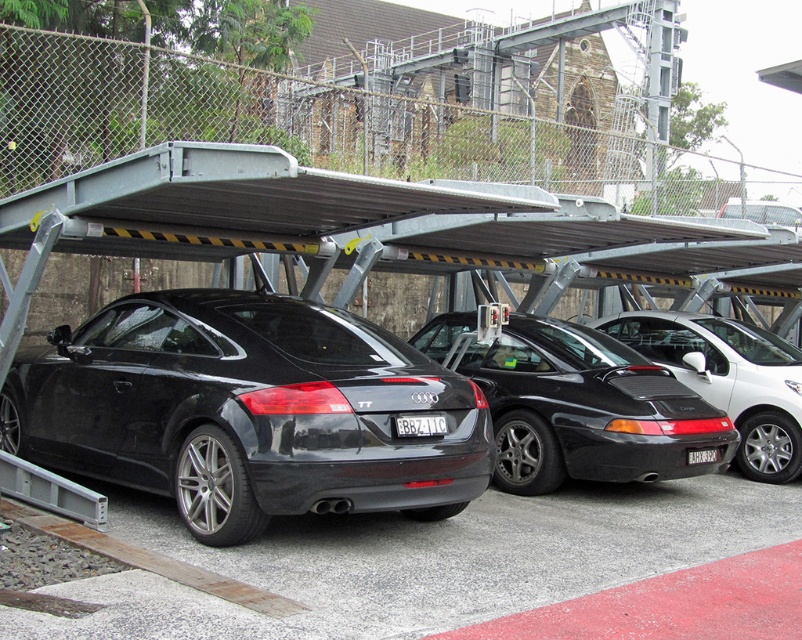
Question: Observing the image, what is the correct spatial positioning of black matte car at center in reference to white plastic license plate at center?

Choices:
 (A) below
 (B) above

Answer: (A)

Question: Which of the following is the closest to the observer?

Choices:
 (A) (709, 456)
 (B) (438, 385)
 (C) (788, 436)

Answer: (B)

Question: In this image, where is glossy black car at center located relative to black matte sports car at center?

Choices:
 (A) left
 (B) right

Answer: (A)

Question: Which point is closer to the camera?

Choices:
 (A) black matte car at center
 (B) black matte sports car at center
 (C) glossy black car at center
 (D) white plastic license plate at center

Answer: (C)

Question: Is black matte sports car at center to the right of white plastic license plate at center from the viewer's perspective?

Choices:
 (A) no
 (B) yes

Answer: (B)

Question: Which point is farther to the camera?

Choices:
 (A) black matte sports car at center
 (B) black matte car at center
 (C) white plastic license plate at center

Answer: (A)